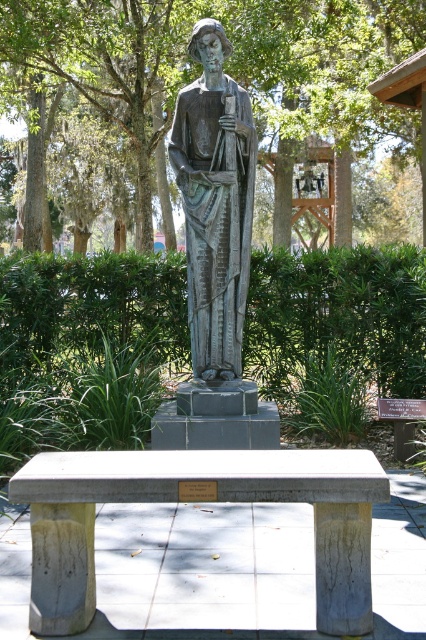
Does point (163, 486) lie behind point (215, 60)?

That is False.

Is gray concrete bench at center further to the viewer compared to bronze statue at center?

No, gray concrete bench at center is in front of bronze statue at center.

This screenshot has width=426, height=640. I want to click on gray concrete bench at center, so click(198, 500).